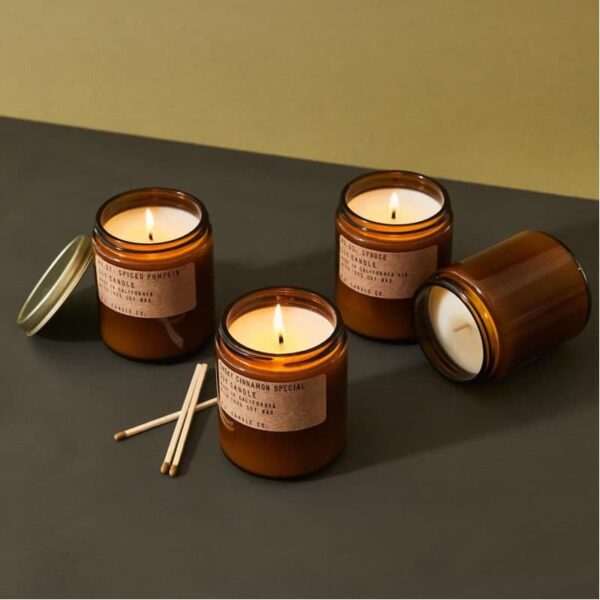
Find the location of `candle lid`. candle lid is located at coordinates (63, 270).